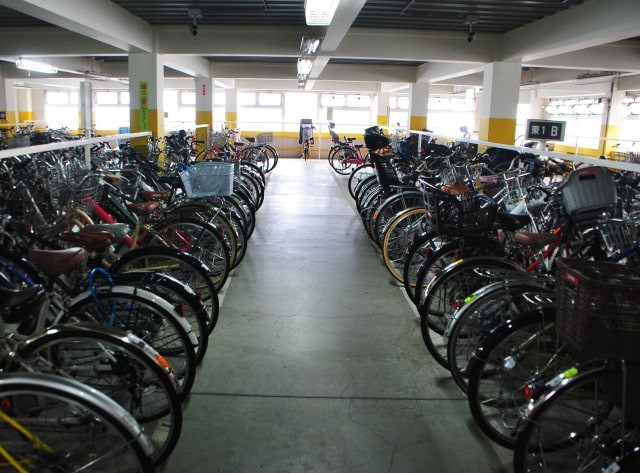
Locate an element on the screen. Image resolution: width=640 pixels, height=473 pixels. pillars is located at coordinates (138, 116), (205, 115), (233, 112), (381, 112), (417, 120), (502, 116), (609, 127), (34, 109), (20, 109), (12, 109).